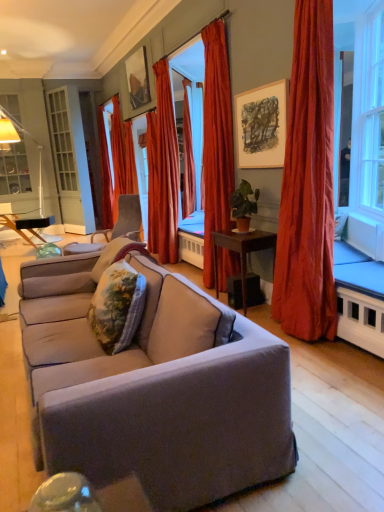
The width and height of the screenshot is (384, 512). Identify the location of velvet red curtain at left, which is the second curtain in left-to-right order. (122, 157).

What do you see at coordinates (115, 254) in the screenshot?
I see `floral fabric pillow at center, the 2th pillow when ordered from front to back` at bounding box center [115, 254].

The image size is (384, 512). What are the coordinates of `wooden table at left, the first table from the back` in the screenshot? It's located at (27, 225).

The height and width of the screenshot is (512, 384). I want to click on satin red curtain at center, which ranks as the second curtain in right-to-left order, so click(x=216, y=142).

How much space does brown wooden table at center, acting as the second table starting from the left, occupy horizontally?

It is 16.98 inches.

Where is `matte black floor lamp at left`? matte black floor lamp at left is located at coordinates (19, 141).

From a real-world perspective, is white glass screen door at left located beneath silky orange curtain at center, the third curtain in the back-to-front sequence?

Actually, white glass screen door at left is physically above silky orange curtain at center, the third curtain in the back-to-front sequence, in the real world.

Which object is further away from the camera taking this photo, white glass screen door at left or silky orange curtain at center, arranged as the third curtain when viewed from the right?

Positioned behind is white glass screen door at left.

From the picture: Can you confirm if white glass screen door at left is bigger than silky orange curtain at center, the third curtain in the back-to-front sequence?

Yes.

Does satin red curtain at center, which is the fourth curtain from left to right, turn towards wooden table at left, which is the second table in right-to-left order?

No, satin red curtain at center, which is the fourth curtain from left to right, is not oriented towards wooden table at left, which is the second table in right-to-left order.

Is satin red curtain at center, arranged as the second curtain when viewed from the front, placed right next to wooden table at left, which ranks as the 2th table in front-to-back order?

No, satin red curtain at center, arranged as the second curtain when viewed from the front, is not beside wooden table at left, which ranks as the 2th table in front-to-back order.

Can you tell me how much satin red curtain at center, arranged as the second curtain when viewed from the front, and wooden table at left, the first table from the back, differ in facing direction?

They differ by 109 degrees in their facing directions.

Does satin red curtain at center, which is the fourth curtain from left to right, have a larger size compared to wooden table at left, which is the second table in right-to-left order?

Yes, satin red curtain at center, which is the fourth curtain from left to right, is bigger than wooden table at left, which is the second table in right-to-left order.

Between satin red curtain at right, the first curtain positioned from the right, and metallic reflective frame at upper center, the 1th picture frame when ordered from back to front, which one appears on the left side from the viewer's perspective?

metallic reflective frame at upper center, the 1th picture frame when ordered from back to front.

Is satin red curtain at right, the first curtain positioned from the right, touching metallic reflective frame at upper center, arranged as the second picture frame when ordered from the bottom?

No, satin red curtain at right, the first curtain positioned from the right, is not beside metallic reflective frame at upper center, arranged as the second picture frame when ordered from the bottom.

From the image's perspective, is satin red curtain at right, which ranks as the fifth curtain in back-to-front order, beneath metallic reflective frame at upper center, marked as the 1th picture frame in a top-to-bottom arrangement?

Yes.

Is satin red curtain at right, marked as the 5th curtain in a left-to-right arrangement, facing towards metallic reflective frame at upper center, which is the 2th picture frame from front to back?

No, satin red curtain at right, marked as the 5th curtain in a left-to-right arrangement, is not aimed at metallic reflective frame at upper center, which is the 2th picture frame from front to back.

Is matte gray couch at center at the right side of satin red curtain at right, marked as the 5th curtain in a left-to-right arrangement?

In fact, matte gray couch at center is to the left of satin red curtain at right, marked as the 5th curtain in a left-to-right arrangement.

Is matte gray couch at center in contact with satin red curtain at right, marked as the 5th curtain in a left-to-right arrangement?

No.

Which point is more forward, [238,466] or [321,142]?

The point [238,466] is in front.

Which object is more forward, matte gray couch at center or satin red curtain at right, which is counted as the 1th curtain, starting from the front?

matte gray couch at center is in front.

Could you tell me if green matte plant at center is facing matte gray couch at center?

No, green matte plant at center is not aimed at matte gray couch at center.

Between green matte plant at center and matte gray couch at center, which one has larger size?

matte gray couch at center.

Does point (233, 203) come behind point (171, 448)?

Yes, it is.

Which object is wider, satin red curtain at right, marked as the 5th curtain in a left-to-right arrangement, or wooden table at left, which ranks as the 2th table in front-to-back order?

wooden table at left, which ranks as the 2th table in front-to-back order, is wider.

Does satin red curtain at right, which ranks as the fifth curtain in back-to-front order, come behind wooden table at left, the first table from the back?

No, satin red curtain at right, which ranks as the fifth curtain in back-to-front order, is closer to the camera.

Is satin red curtain at right, the first curtain positioned from the right, next to wooden table at left, which is the second table in right-to-left order, and touching it?

satin red curtain at right, the first curtain positioned from the right, and wooden table at left, which is the second table in right-to-left order, are clearly separated.

This screenshot has width=384, height=512. Identify the location of chair that appears behind the satin red curtain at right, marked as the 5th curtain in a left-to-right arrangement. (114, 227).

Which is correct: velvet gray chair at center is inside satin red curtain at right, the first curtain positioned from the right, or outside of it?

The correct answer is: outside.

Is velvet gray chair at center bigger or smaller than satin red curtain at right, the first curtain positioned from the right?

velvet gray chair at center is smaller than satin red curtain at right, the first curtain positioned from the right.

From the picture: From the image's perspective, is velvet gray chair at center located above or below satin red curtain at right, which is counted as the 1th curtain, starting from the front?

velvet gray chair at center is below satin red curtain at right, which is counted as the 1th curtain, starting from the front.

Where is `curtain that is the 3rd one when counting downward from the white glass screen door at left (from the image's perspective)`? curtain that is the 3rd one when counting downward from the white glass screen door at left (from the image's perspective) is located at coordinates (167, 166).

Locate an element on the screen. This screenshot has width=384, height=512. table to the left of satin red curtain at center, which is the fourth curtain from left to right is located at coordinates (27, 225).

Which object lies nearer to the anchor point matte black floor lamp at left, green matte plant at center or velvet red curtain at left, placed as the 4th curtain when sorted from right to left?

The object closer to matte black floor lamp at left is velvet red curtain at left, placed as the 4th curtain when sorted from right to left.

Considering their positions, is satin red curtain at right, which ranks as the fifth curtain in back-to-front order, positioned closer to white glass screen door at left than velvet red curtain at left, which is the second curtain in left-to-right order?

velvet red curtain at left, which is the second curtain in left-to-right order, lies closer to white glass screen door at left than the other object.

From the picture: Considering their positions, is metallic reflective frame at upper center, the second picture frame from the right, positioned closer to matte black floor lamp at left than satin red curtain at right, which is counted as the 1th curtain, starting from the front?

Among the two, metallic reflective frame at upper center, the second picture frame from the right, is located nearer to matte black floor lamp at left.

Considering their positions, is matte black floor lamp at left positioned further to metallic reflective frame at upper center, which is the 2th picture frame from front to back, than brown wooden table at center, acting as the second table starting from the back?

brown wooden table at center, acting as the second table starting from the back, lies further to metallic reflective frame at upper center, which is the 2th picture frame from front to back, than the other object.

Based on their spatial positions, is velvet gray chair at center or brown wooden table at center, which ranks as the 1th table in right-to-left order, closer to velvet red curtain at left, placed as the 4th curtain when sorted from front to back?

velvet gray chair at center lies closer to velvet red curtain at left, placed as the 4th curtain when sorted from front to back, than the other object.

In the scene shown: Based on their spatial positions, is satin red curtain at center, which ranks as the 4th curtain in back-to-front order, or matte gray couch at center further from floral fabric pillow at center, the 2th pillow when ordered from front to back?

The object further to floral fabric pillow at center, the 2th pillow when ordered from front to back, is satin red curtain at center, which ranks as the 4th curtain in back-to-front order.

Estimate the real-world distances between objects in this image. Which object is further from matte gray couch at center, metallic reflective frame at upper center, marked as the 1th picture frame in a top-to-bottom arrangement, or matte wooden picture frame at upper center, which is counted as the 2th picture frame, starting from the back?

Based on the image, metallic reflective frame at upper center, marked as the 1th picture frame in a top-to-bottom arrangement, appears to be further to matte gray couch at center.

Based on their spatial positions, is green matte plant at center or velvet red curtain at left, which is counted as the fifth curtain, starting from the right, further from white glass screen door at left?

green matte plant at center is further to white glass screen door at left.

At what (x,y) coordinates should I click in order to perform the action: click on picture frame between floral fabric pillow at center, which is the 1th pillow in back-to-front order, and metallic reflective frame at upper center, arranged as the 1th picture frame when viewed from the left, from front to back. Please return your answer as a coordinate pair (x, y). Image resolution: width=384 pixels, height=512 pixels. Looking at the image, I should click on (262, 126).

Where is `chair between green matte plant at center and velvet red curtain at left, placed as the 4th curtain when sorted from right to left, along the z-axis`? This screenshot has height=512, width=384. chair between green matte plant at center and velvet red curtain at left, placed as the 4th curtain when sorted from right to left, along the z-axis is located at coordinates (114, 227).

Find the location of a particular element. chair between matte wooden picture frame at upper center, placed as the second picture frame when sorted from left to right, and metallic reflective frame at upper center, which is the 2th picture frame from front to back, along the z-axis is located at coordinates (114, 227).

The image size is (384, 512). I want to click on screen door between floral fabric pillow at center, which is counted as the first pillow, starting from the front, and matte black floor lamp at left, along the z-axis, so click(70, 160).